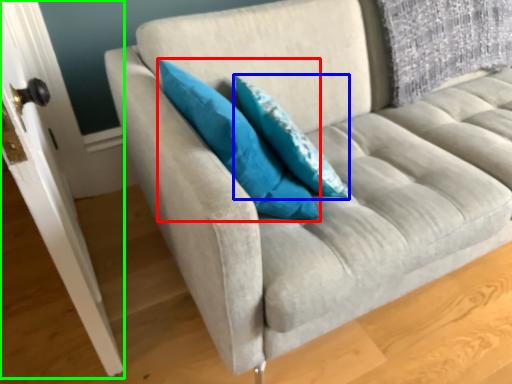
Question: Which is farther away from pillow (highlighted by a red box)? pillow (highlighted by a blue box) or door (highlighted by a green box)?

Choices:
 (A) pillow
 (B) door

Answer: (B)